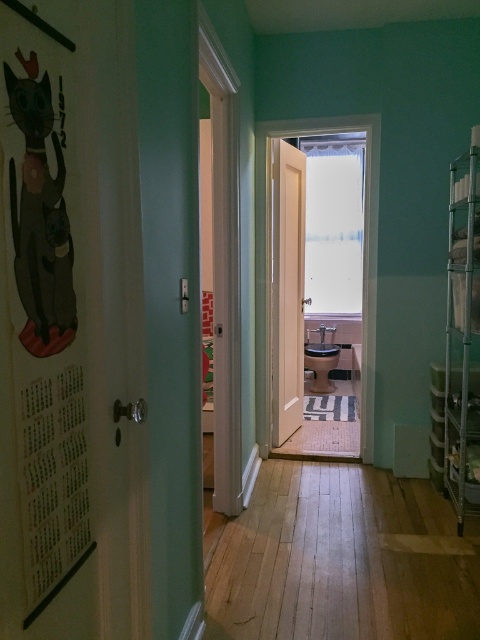
Does light brown wood flooring at center have a lesser width compared to matte black cat at left?

Incorrect, light brown wood flooring at center's width is not less than matte black cat at left's.

In the scene shown: Does light brown wood flooring at center have a smaller size compared to matte black cat at left?

Incorrect, light brown wood flooring at center is not smaller in size than matte black cat at left.

What are the coordinates of `light brown wood flooring at center` in the screenshot? It's located at (343, 560).